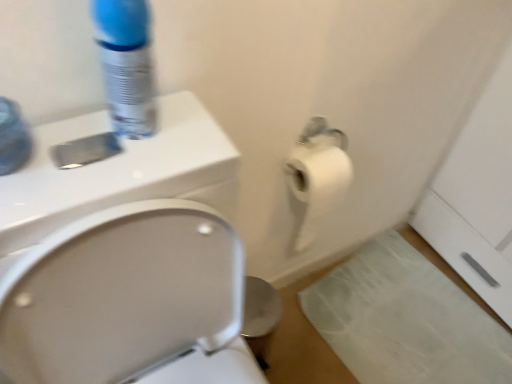
At what (x,y) coordinates should I click in order to perform the action: click on vacant region to the left of metallic silver spray can at upper left. Please return your answer as a coordinate pair (x, y). The image size is (512, 384). Looking at the image, I should click on (76, 124).